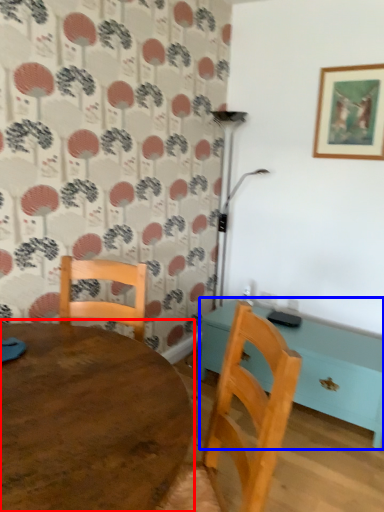
Question: Which of the following is the farthest to the observer, table (highlighted by a red box) or table (highlighted by a blue box)?

Choices:
 (A) table
 (B) table

Answer: (B)